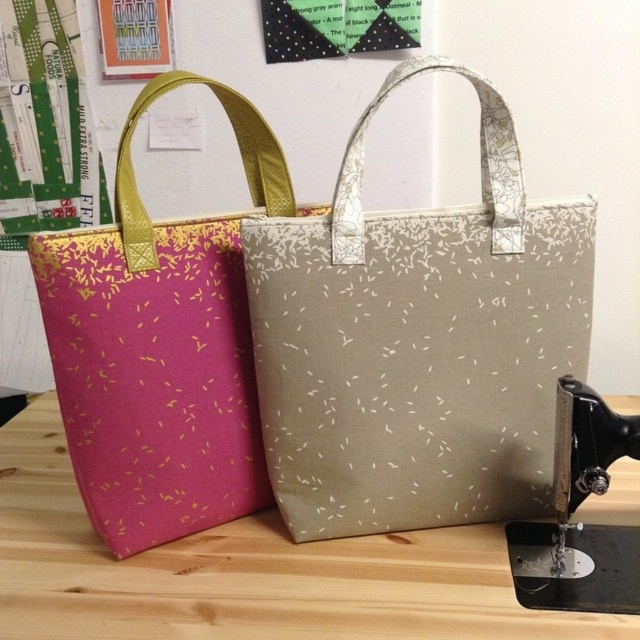
You are a customer looking to pick up the pink fabric tote at left from the wooden table at center. Which object do you need to move first to access the tote?

The pink fabric tote at left is further to the viewer than the wooden table at center, so you need to move the pink fabric tote at left first to access it.

You are a tailor trying to measure the distance between two points on a sewing project. The points are labeled as point (56, 378). Can you determine if the distance between them is sufficient to allow a 25 inch long decorative ribbon to span the gap without stretching?

The distance between the two points labeled as point (56, 378) is 26.19 inches, which is longer than the 25 inch ribbon. Therefore, the ribbon can span the gap without stretching.